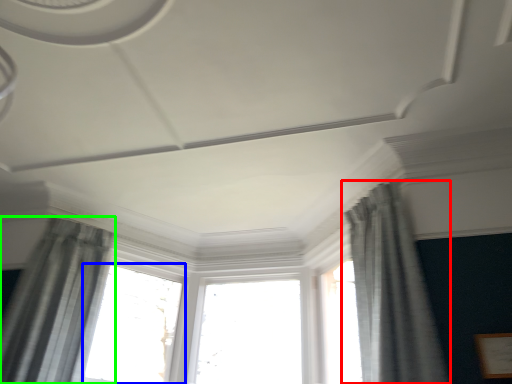
Question: Which object is the farthest from curtain (highlighted by a red box)? Choose among these: window (highlighted by a blue box) or curtain (highlighted by a green box).

Choices:
 (A) window
 (B) curtain

Answer: (B)